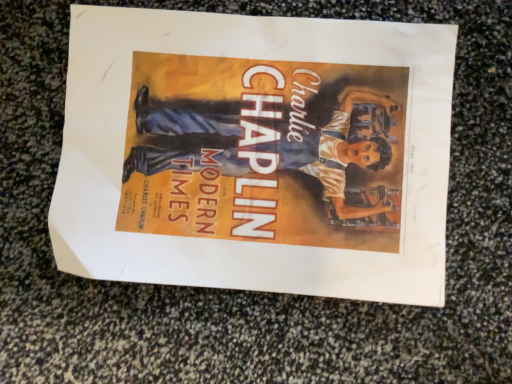
Locate an element on the screen. The width and height of the screenshot is (512, 384). matte paper poster at center is located at coordinates (255, 153).

Describe the element at coordinates (255, 153) in the screenshot. This screenshot has height=384, width=512. I see `matte paper poster at center` at that location.

In order to face matte paper poster at center, should I rotate leftwards or rightwards?

A 1.054 degree turn to the left will do.

Find the location of `matte paper poster at center`. matte paper poster at center is located at coordinates (255, 153).